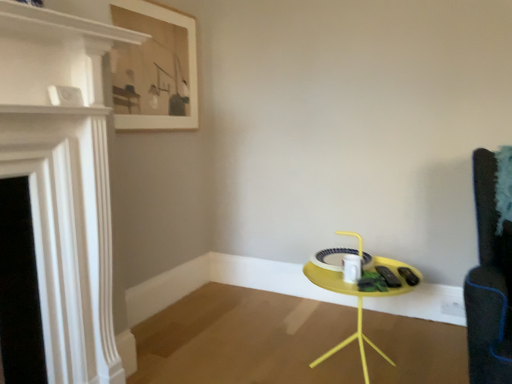
Where is `wooden framed artwork at upper left`? This screenshot has width=512, height=384. wooden framed artwork at upper left is located at coordinates (160, 67).

Measure the distance between white glossy fireplace at left and camera.

white glossy fireplace at left is 3.57 feet from camera.

Locate an element on the screen. The height and width of the screenshot is (384, 512). wooden framed artwork at upper left is located at coordinates (160, 67).

Is yellow matte table at center oriented towards white glossy fireplace at left?

No, yellow matte table at center is not oriented towards white glossy fireplace at left.

How far apart are yellow matte table at center and white glossy fireplace at left?

Answer: yellow matte table at center and white glossy fireplace at left are 3.45 feet apart from each other.

How different are the orientations of yellow matte table at center and white glossy fireplace at left in degrees?

The angle between the facing direction of yellow matte table at center and the facing direction of white glossy fireplace at left is 90.9 degrees.

Are yellow matte table at center and white glossy fireplace at left making contact?

They are not placed beside each other.

Can you confirm if wooden framed artwork at upper left is bigger than yellow matte table at center?

No, wooden framed artwork at upper left is not bigger than yellow matte table at center.

From a real-world perspective, is wooden framed artwork at upper left located higher than yellow matte table at center?

Yes.

Does wooden framed artwork at upper left have a lesser height compared to yellow matte table at center?

In fact, wooden framed artwork at upper left may be taller than yellow matte table at center.

Is wooden framed artwork at upper left positioned far away from yellow matte table at center?

Absolutely, wooden framed artwork at upper left is distant from yellow matte table at center.

Who is shorter, yellow matte table at center or wooden framed artwork at upper left?

With less height is yellow matte table at center.

From the image's perspective, would you say yellow matte table at center is shown under wooden framed artwork at upper left?

Yes, from the image's perspective, yellow matte table at center is beneath wooden framed artwork at upper left.

Which is more to the left, yellow matte table at center or wooden framed artwork at upper left?

Positioned to the left is wooden framed artwork at upper left.

Does point (322, 275) lie in front of point (197, 99)?

Yes, it is.

From a real-world perspective, which is physically above, white glossy fireplace at left or yellow matte table at center?

white glossy fireplace at left, from a real-world perspective.

Considering the points (86, 254) and (366, 365), which point is in front, point (86, 254) or point (366, 365)?

Point (86, 254)

Is white glossy fireplace at left aimed at yellow matte table at center?

No, white glossy fireplace at left is not turned towards yellow matte table at center.

In the scene shown: Would you say white glossy fireplace at left is inside or outside yellow matte table at center?

white glossy fireplace at left is not enclosed by yellow matte table at center.

From a real-world perspective, between white glossy fireplace at left and wooden framed artwork at upper left, who is vertically lower?

In real-world perspective, white glossy fireplace at left is lower.

Is the depth of white glossy fireplace at left greater than that of wooden framed artwork at upper left?

No, the depth of white glossy fireplace at left is less than that of wooden framed artwork at upper left.

Is white glossy fireplace at left turned away from wooden framed artwork at upper left?

No, white glossy fireplace at left is not facing away from wooden framed artwork at upper left.

The width and height of the screenshot is (512, 384). Find the location of `picture frame located above the white glossy fireplace at left (from the image's perspective)`. picture frame located above the white glossy fireplace at left (from the image's perspective) is located at coordinates (160, 67).

How much distance is there between wooden framed artwork at upper left and white glossy fireplace at left?

wooden framed artwork at upper left and white glossy fireplace at left are 37.08 inches apart from each other.

Between point (170, 119) and point (76, 286), which one is positioned in front?

The point (76, 286) is more forward.

In the scene shown: From the image's perspective, is wooden framed artwork at upper left on white glossy fireplace at left?

Yes.

Locate an element on the screen. The height and width of the screenshot is (384, 512). fireplace lying above the yellow matte table at center (from the image's perspective) is located at coordinates (64, 179).

The image size is (512, 384). What are the coordinates of `picture frame that appears on the left of yellow matte table at center` in the screenshot? It's located at (160, 67).

Consider the image. Estimate the real-world distances between objects in this image. Which object is further from white glossy fireplace at left, wooden framed artwork at upper left or yellow matte table at center?

yellow matte table at center is further to white glossy fireplace at left.

Which object lies further to the anchor point white glossy fireplace at left, yellow matte table at center or wooden framed artwork at upper left?

yellow matte table at center.

Which object lies nearer to the anchor point yellow matte table at center, white glossy fireplace at left or wooden framed artwork at upper left?

white glossy fireplace at left lies closer to yellow matte table at center than the other object.

From the image, which object appears to be nearer to wooden framed artwork at upper left, yellow matte table at center or white glossy fireplace at left?

white glossy fireplace at left is positioned closer to the anchor wooden framed artwork at upper left.

Looking at the image, which one is located closer to wooden framed artwork at upper left, white glossy fireplace at left or yellow matte table at center?

white glossy fireplace at left.

Which object lies nearer to the anchor point yellow matte table at center, wooden framed artwork at upper left or white glossy fireplace at left?

white glossy fireplace at left.

You are a GUI agent. You are given a task and a screenshot of the screen. Output one action in this format:
    pyautogui.click(x=<x>, y=<y>)
    Task: Click on the fireplace between wooden framed artwork at upper left and yellow matte table at center in the up-down direction
    
    Given the screenshot: What is the action you would take?
    pyautogui.click(x=64, y=179)